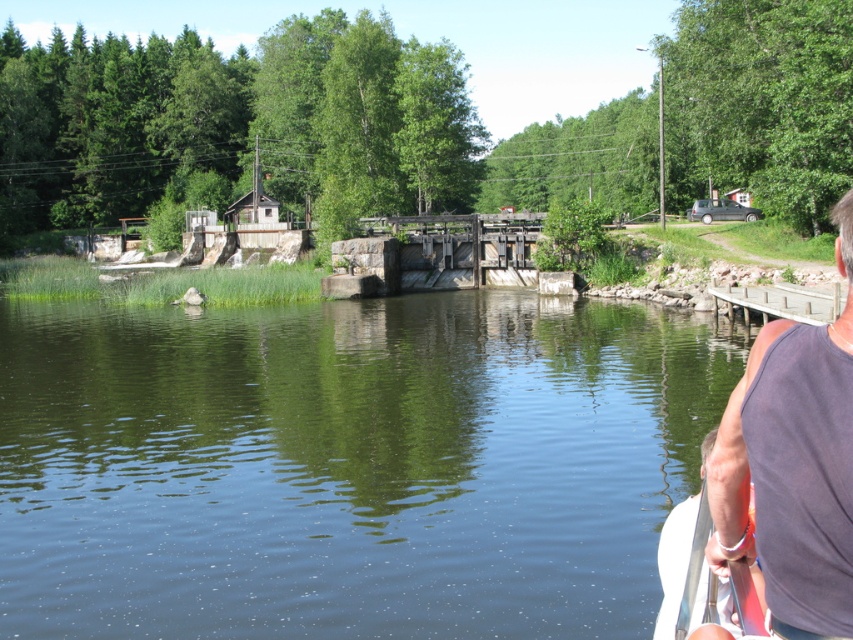
Describe the element at coordinates (347, 465) in the screenshot. I see `green smooth water at center` at that location.

Who is positioned more to the left, green smooth water at center or dark gray tank top at right?

Positioned to the left is green smooth water at center.

Between point (312, 371) and point (798, 324), which one is positioned in front?

Point (798, 324)

Where is `green smooth water at center`? The width and height of the screenshot is (853, 640). green smooth water at center is located at coordinates (347, 465).

Is dark gray tank top at right below white plastic paddle at lower right?

Incorrect, dark gray tank top at right is not positioned below white plastic paddle at lower right.

Is dark gray tank top at right above white plastic paddle at lower right?

Yes, dark gray tank top at right is above white plastic paddle at lower right.

Is point (712, 467) farther from viewer compared to point (677, 620)?

No, (712, 467) is in front of (677, 620).

The height and width of the screenshot is (640, 853). I want to click on dark gray tank top at right, so click(x=792, y=467).

Is point (219, 564) closer to camera compared to point (663, 589)?

No, it is not.

Is green smooth water at center bigger than white plastic paddle at right?

Yes, green smooth water at center is bigger than white plastic paddle at right.

Does point (206, 412) come closer to viewer compared to point (722, 588)?

No.

Locate an element on the screen. green smooth water at center is located at coordinates (347, 465).